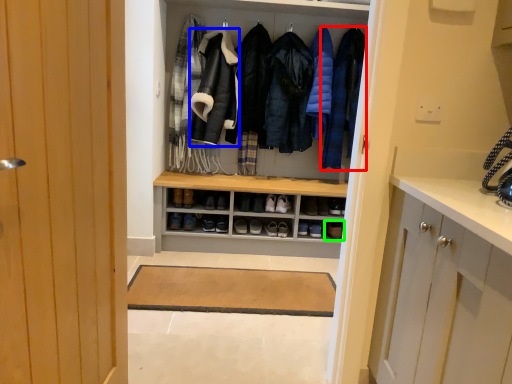
Question: Which object is positioned farthest from clothing (highlighted by a red box)? Select from garment (highlighted by a blue box) and footwear (highlighted by a green box).

Choices:
 (A) garment
 (B) footwear

Answer: (B)